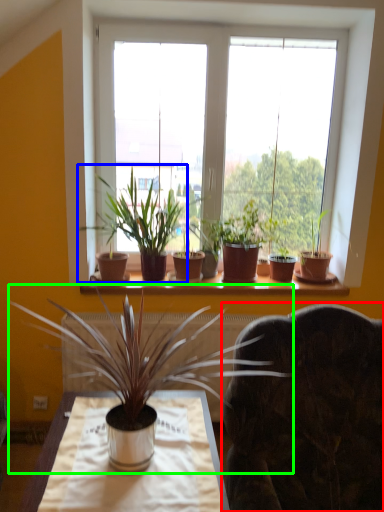
Question: Which object is positioned farthest from swivel chair (highlighted by a red box)? Select from houseplant (highlighted by a blue box) and houseplant (highlighted by a green box).

Choices:
 (A) houseplant
 (B) houseplant

Answer: (A)